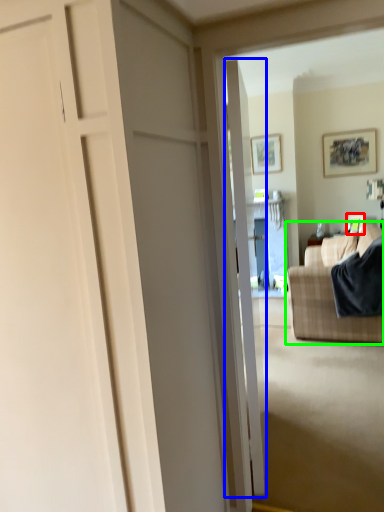
Question: Which is farther away from picture frame (highlighted by a red box)? door (highlighted by a blue box) or studio couch (highlighted by a green box)?

Choices:
 (A) door
 (B) studio couch

Answer: (A)